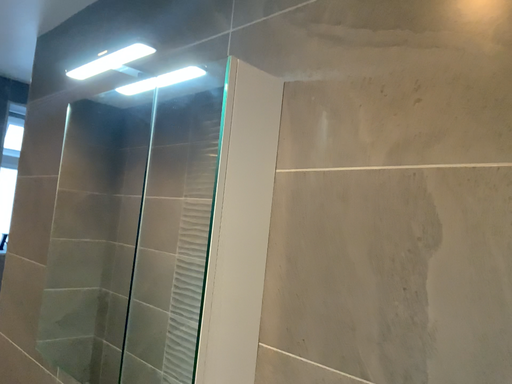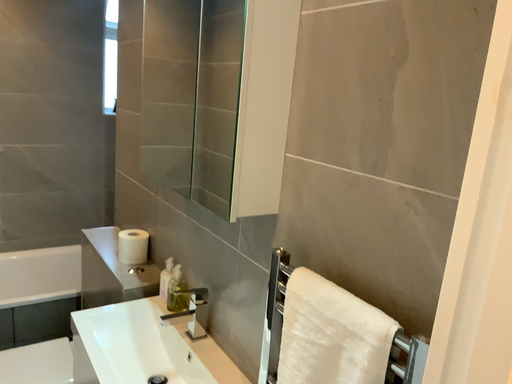
Question: How did the camera likely rotate when shooting the video?

Choices:
 (A) rotated right
 (B) rotated left

Answer: (B)